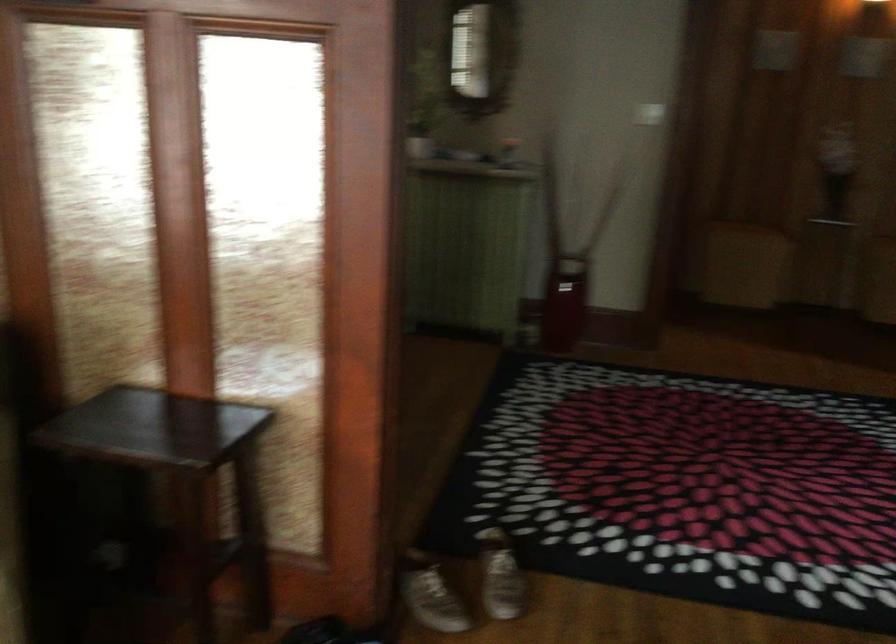
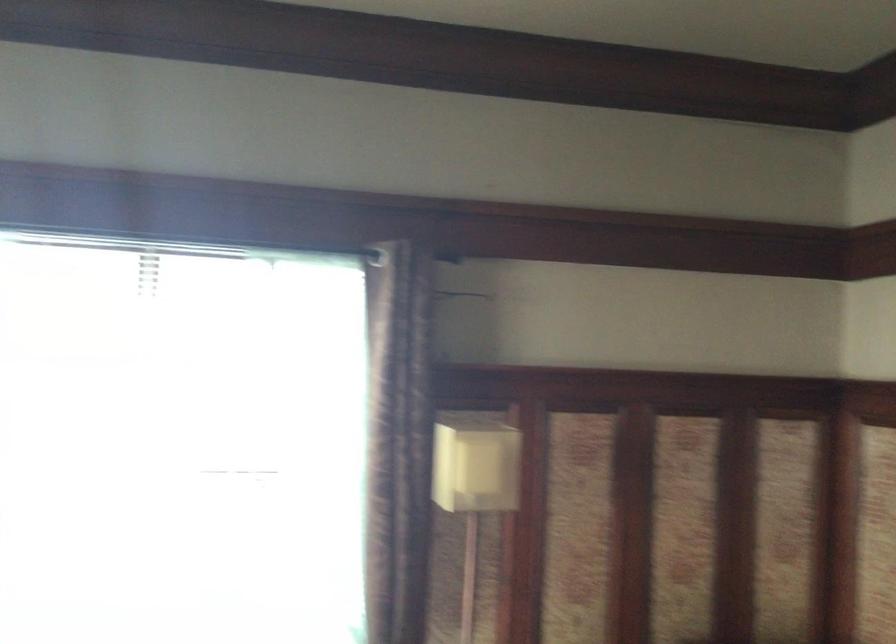
Question: The images are taken continuously from a first-person perspective. In which direction is your viewpoint rotating?

Choices:
 (A) Left
 (B) Right
 (C) Up
 (D) Down

Answer: (A)